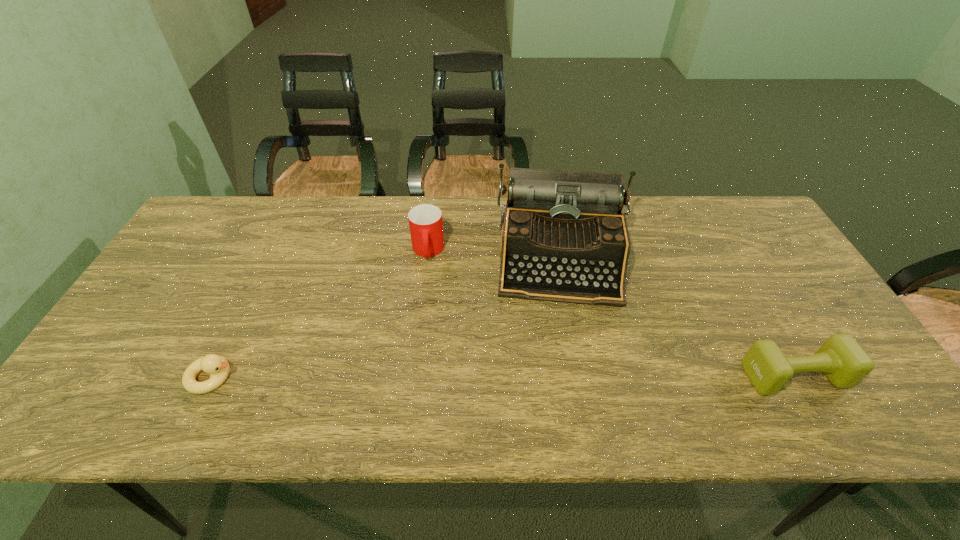
This screenshot has height=540, width=960. I want to click on vacant area that lies between the third object from left to right and the duckling, so click(x=388, y=318).

At what (x,y) coordinates should I click in order to perform the action: click on free area in between the third object from right to left and the rightmost object. Please return your answer as a coordinate pair (x, y). The image size is (960, 540). Looking at the image, I should click on (611, 313).

Where is `free spot between the cup and the third object from left to right`? This screenshot has width=960, height=540. free spot between the cup and the third object from left to right is located at coordinates (496, 254).

This screenshot has height=540, width=960. I want to click on vacant space that's between the duckling and the third tallest object, so click(x=503, y=376).

Find the location of a particular element. empty space that is in between the third shortest object and the third tallest object is located at coordinates (611, 313).

This screenshot has width=960, height=540. Identify the location of vacant area between the typewriter and the second shortest object. (679, 316).

Find the location of a particular element. This screenshot has width=960, height=540. free space between the third shortest object and the typewriter is located at coordinates (496, 254).

Identify the location of free space between the third object from left to right and the leftmost object. (388, 318).

At what (x,y) coordinates should I click in order to perform the action: click on object that is the second closest one to the second shortest object. Please return your answer as a coordinate pair (x, y). This screenshot has height=540, width=960. Looking at the image, I should click on (425, 221).

Find the location of `object identified as the third closest to the second object from left to right`. object identified as the third closest to the second object from left to right is located at coordinates (843, 361).